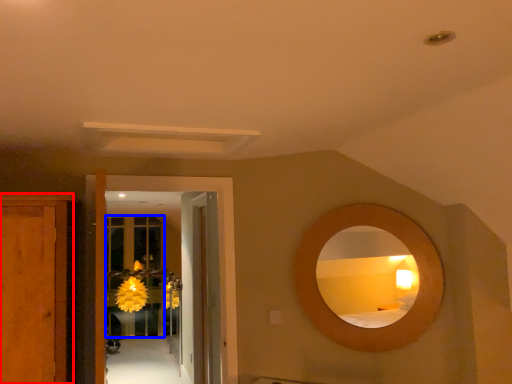
Question: Which point is closer to the camera, cabinetry (highlighted by a red box) or glass door (highlighted by a blue box)?

Choices:
 (A) cabinetry
 (B) glass door

Answer: (A)